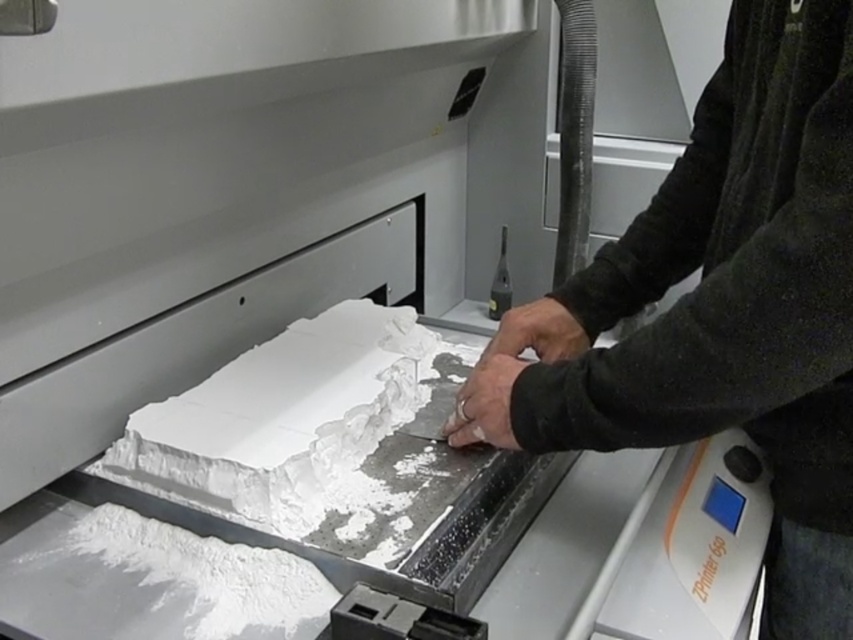
Does black matte hands at center appear over white matte cake at center?

Correct, black matte hands at center is located above white matte cake at center.

Does black matte hands at center appear on the left side of white matte cake at center?

No, black matte hands at center is not to the left of white matte cake at center.

Is point (744, 332) more distant than point (347, 436)?

No, it is in front of (347, 436).

The width and height of the screenshot is (853, 640). I want to click on black matte hands at center, so click(721, 308).